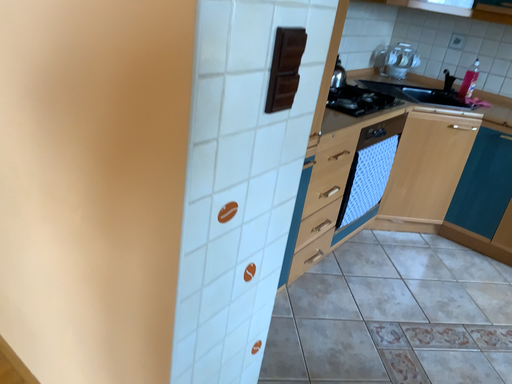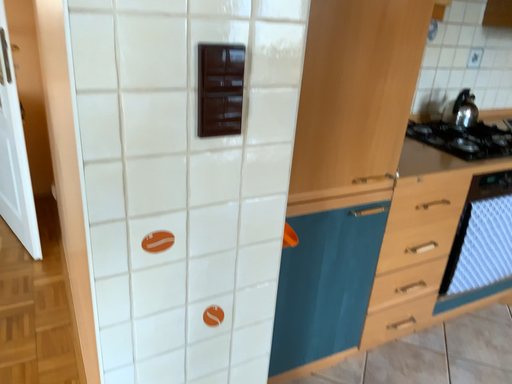
Question: Which way did the camera rotate in the video?

Choices:
 (A) rotated left
 (B) rotated right

Answer: (A)